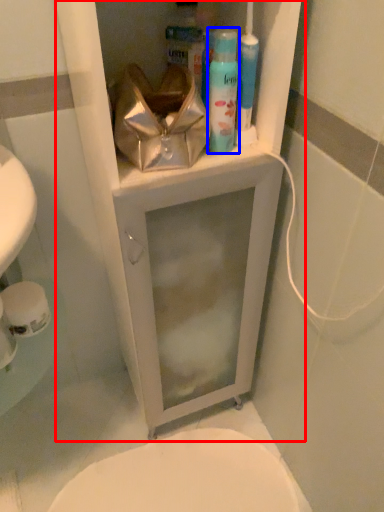
Question: Among these objects, which one is farthest to the camera, medicine cabinet (highlighted by a red box) or shaving cream (highlighted by a blue box)?

Choices:
 (A) medicine cabinet
 (B) shaving cream

Answer: (B)